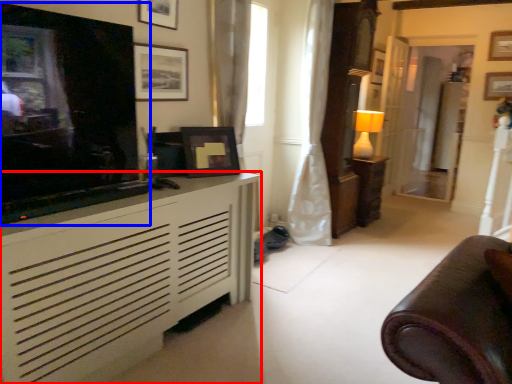
Question: Which of the following is the farthest to the observer, cabinetry (highlighted by a red box) or television (highlighted by a blue box)?

Choices:
 (A) cabinetry
 (B) television

Answer: (B)